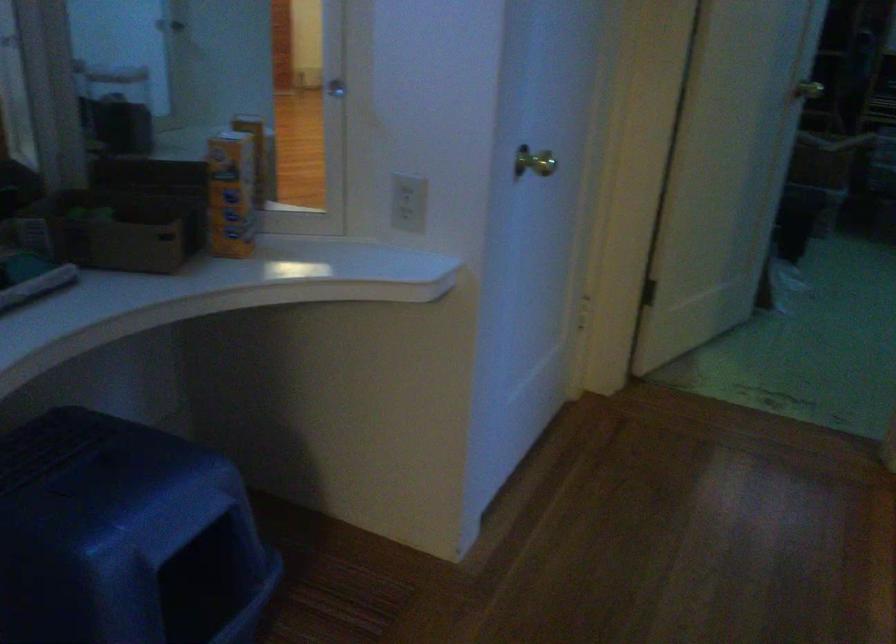
I want to click on yellow baking soda box, so click(x=230, y=194).